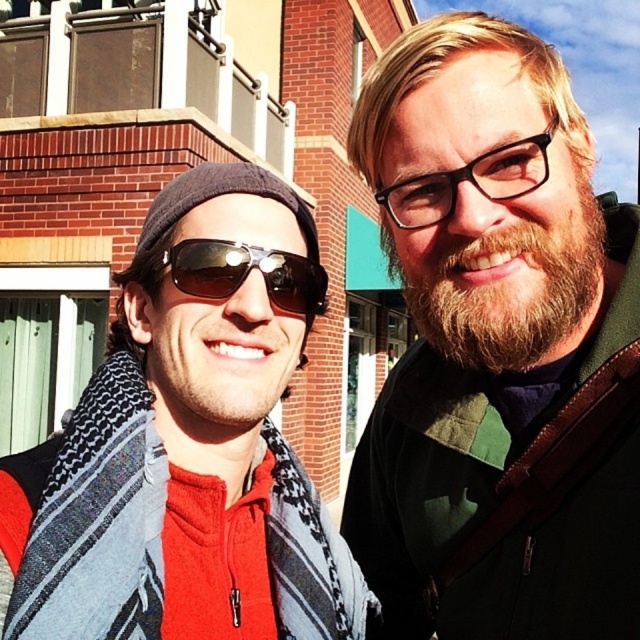
Which is below, brown fuzzy beard at right or sunglasses at center?

sunglasses at center

Which is above, brown fuzzy beard at right or sunglasses at center?

brown fuzzy beard at right is higher up.

Image resolution: width=640 pixels, height=640 pixels. Find the location of `brown fuzzy beard at right`. brown fuzzy beard at right is located at coordinates (508, 289).

Find the location of a particular element. The image size is (640, 640). brown fuzzy beard at right is located at coordinates (508, 289).

Does point (413, 406) come closer to viewer compared to point (176, 269)?

No, it is behind (176, 269).

Is point (394, 157) behind point (317, 266)?

Yes, point (394, 157) is behind point (317, 266).

The height and width of the screenshot is (640, 640). In order to click on bearded man at center in this screenshot , I will do `click(497, 349)`.

Does gray woven scarf at left come behind sunglasses at center?

That is False.

Is gray woven scarf at left smaller than sunglasses at center?

No.

Find the location of a particular element. The width and height of the screenshot is (640, 640). gray woven scarf at left is located at coordinates (97, 520).